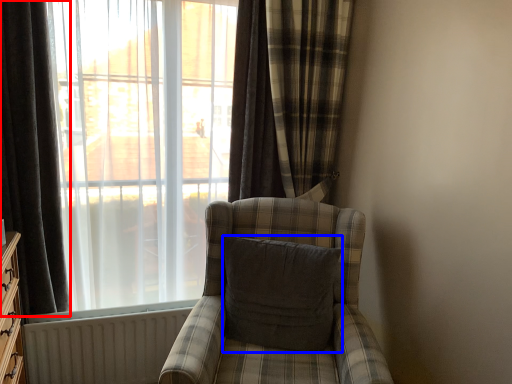
Question: Among these objects, which one is nearest to the camera, curtain (highlighted by a red box) or pillow (highlighted by a blue box)?

Choices:
 (A) curtain
 (B) pillow

Answer: (A)